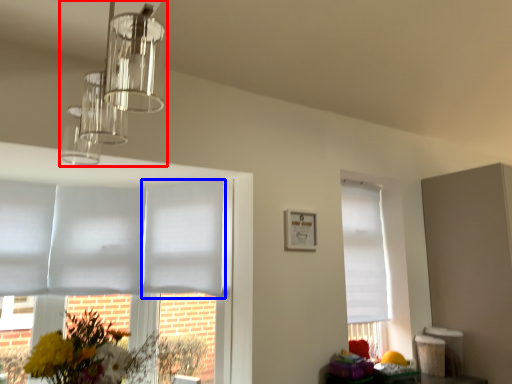
Question: Which object is closer to the camera taking this photo, lamp (highlighted by a red box) or blind (highlighted by a blue box)?

Choices:
 (A) lamp
 (B) blind

Answer: (A)